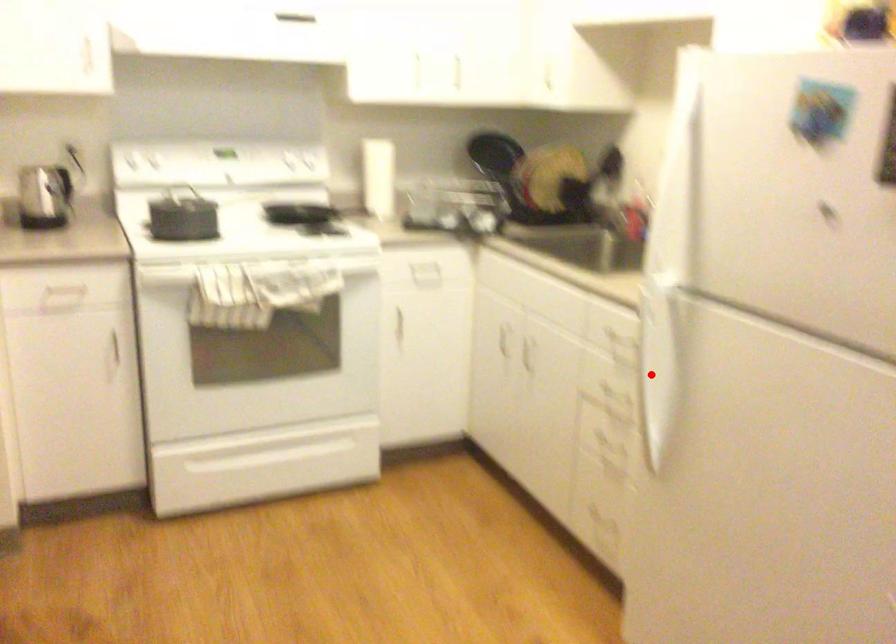
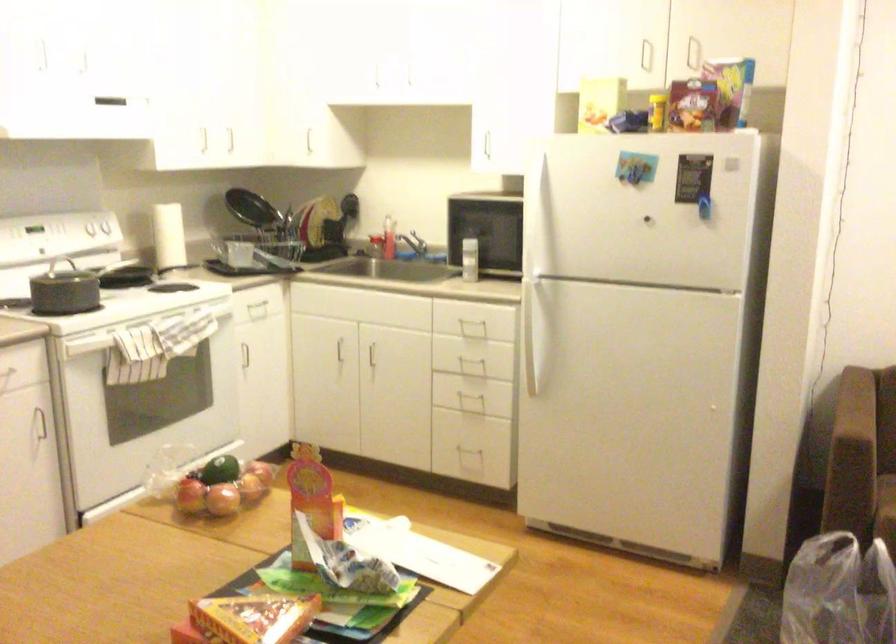
In the second image, find the point that corresponds to the highlighted location in the first image.

(536, 328)